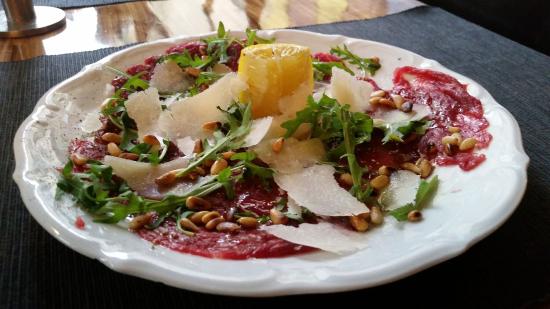
You are a GUI agent. You are given a task and a screenshot of the screen. Output one action in this format:
    pyautogui.click(x=<x>, y=<y>)
    Task: Click on the black placemat
    
    Given the screenshot: What is the action you would take?
    pyautogui.click(x=432, y=45)